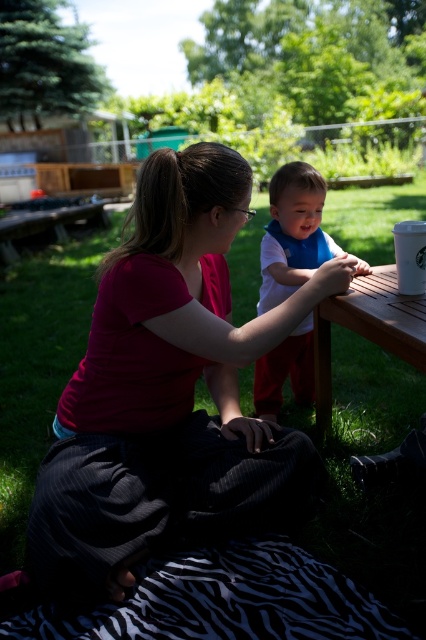
Question: Is white matte bib at center closer to the viewer compared to wooden table at center?

Choices:
 (A) yes
 (B) no

Answer: (B)

Question: Among these points, which one is nearest to the camera?

Choices:
 (A) (181, 620)
 (B) (264, 413)
 (C) (143, 228)

Answer: (A)

Question: Is white matte bib at center closer to the viewer compared to wooden table at center?

Choices:
 (A) yes
 (B) no

Answer: (B)

Question: Which is nearer to the zebra-patterned fabric at lower center?

Choices:
 (A) matte red shirt at center
 (B) white matte bib at center

Answer: (A)

Question: Does white matte bib at center have a larger size compared to wooden table at center?

Choices:
 (A) no
 (B) yes

Answer: (B)

Question: Which point is farther from the camera taking this photo?

Choices:
 (A) (209, 198)
 (B) (54, 618)

Answer: (A)